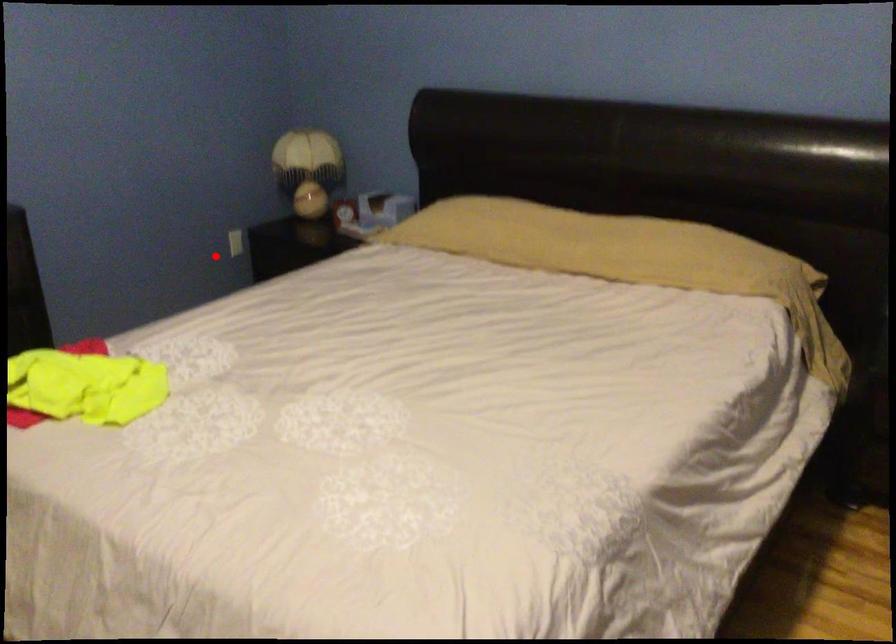
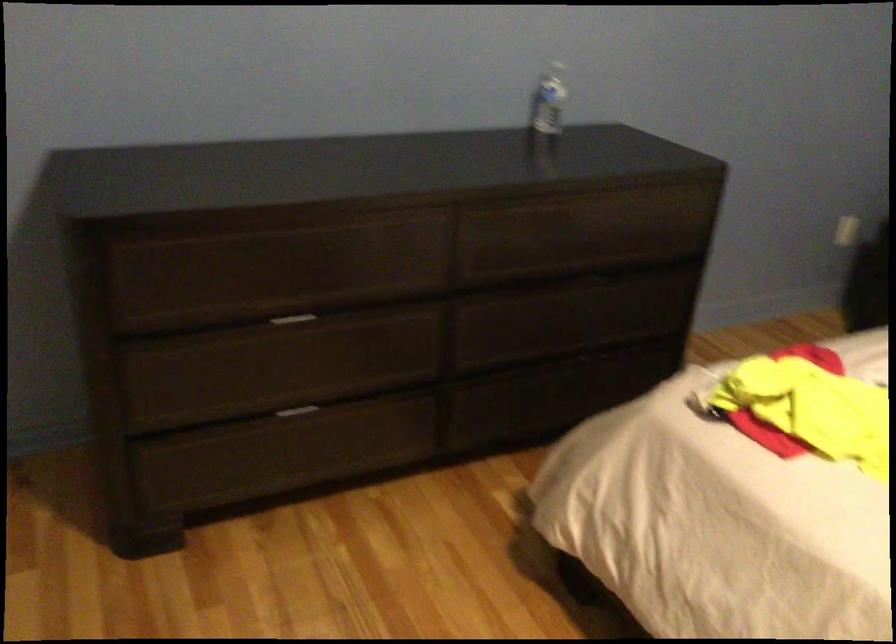
In the second image, find the point that corresponds to the highlighted location in the first image.

(848, 231)